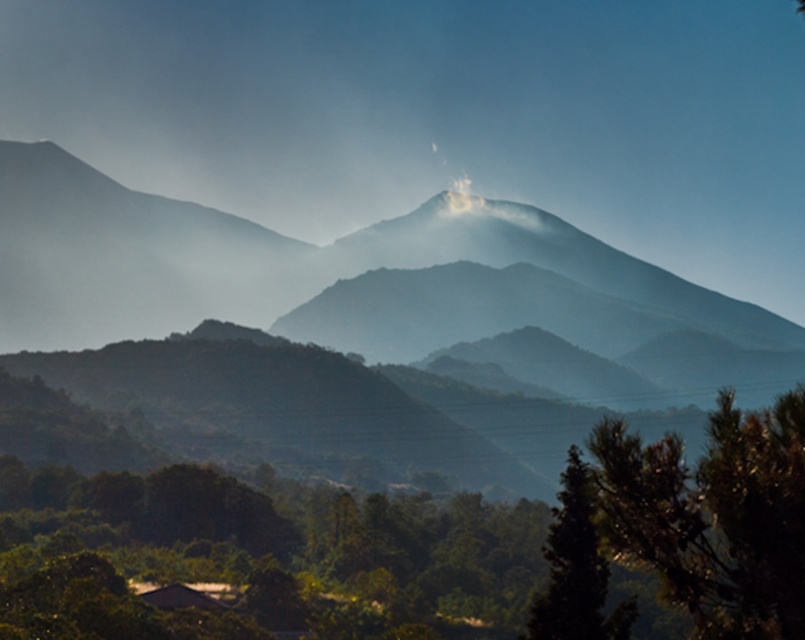
You are a hiker planning to take a photo of the smokey gray mountain range at center from a specific spot. If your camera can only capture objects within a 0.4 to 0.45 coordinate range on the horizontal axis, will the mountain range be fully visible in your photo?

The smokey gray mountain range at center is located at point 0.425 on the horizontal axis, which falls within the 0.4 to 0.45 coordinate range. Therefore, the mountain range will be fully visible in your photo.

You are a hiker standing at the edge of the forest looking towards the mountain. You see the green leafy tree at center and the smokey gray mountain range at center. Which object is closer to you?

The green leafy tree at center is closer to you because it is positioned on the right side of the smokey gray mountain range at center, which is further away.

You are standing in the landscape and want to take a photo of the smokey gray mountain range at center without the green leafy tree at lower right blocking the view. Is there a way to do this?

The smokey gray mountain range at center is positioned under the green leafy tree at lower right, so if you move to the side away from the tree, you can position yourself where the mountain range is no longer blocked by the tree.